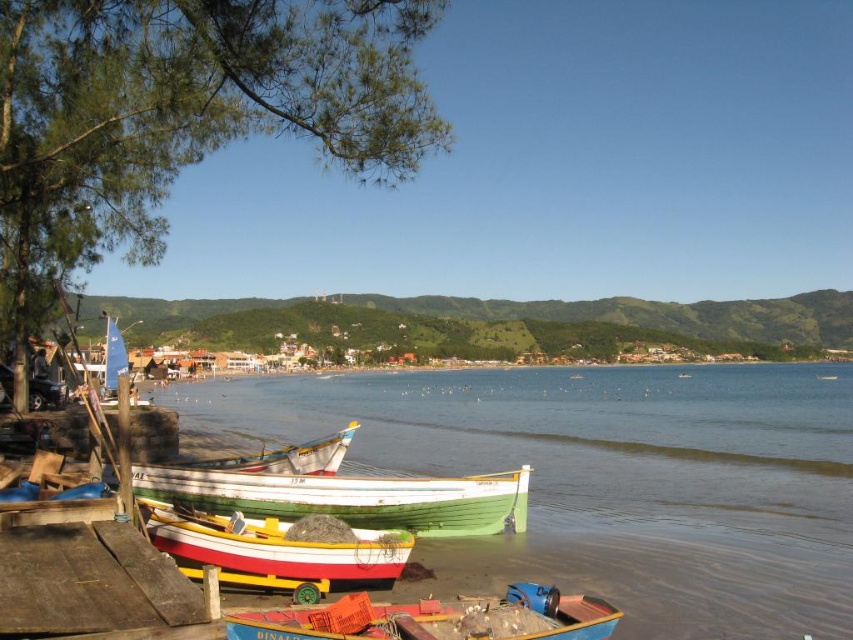
Does clear water at center have a lesser width compared to white wooden boat at center?

Incorrect, clear water at center's width is not less than white wooden boat at center's.

The height and width of the screenshot is (640, 853). I want to click on clear water at center, so click(607, 480).

Who is more distant from viewer, (675, 420) or (253, 554)?

Positioned behind is point (675, 420).

Locate an element on the screen. The width and height of the screenshot is (853, 640). clear water at center is located at coordinates (607, 480).

Is point (96, 564) positioned behind point (445, 513)?

No, (96, 564) is closer to viewer.

Can you confirm if wooden at lower left is positioned above green wooden boat at center?

Yes.

Is point (135, 564) positioned in front of point (479, 492)?

That is True.

I want to click on wooden at lower left, so click(x=91, y=582).

Can you confirm if green wooden boat at center is shorter than white wooden boat at center?

In fact, green wooden boat at center may be taller than white wooden boat at center.

From the picture: Who is more forward, [424,508] or [165,538]?

Point [165,538] is more forward.

Where is `green wooden boat at center`? Image resolution: width=853 pixels, height=640 pixels. green wooden boat at center is located at coordinates (350, 497).